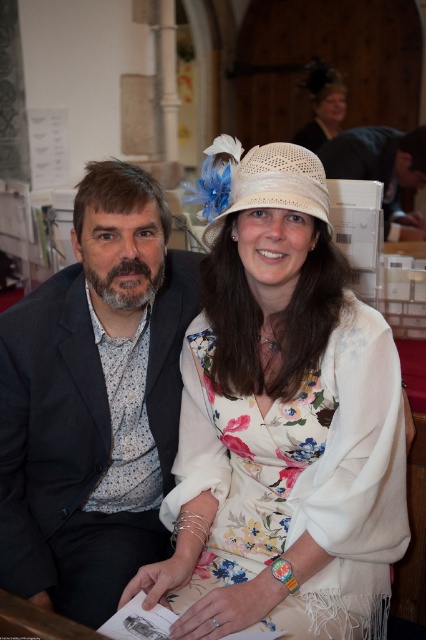
You are a photographer taking a picture of the two people in the scene. You want to ensure both the floral silk dress at center and the white straw hat at center are clearly visible in the frame. Given their sizes, which object might require more careful positioning to avoid being obscured?

The floral silk dress at center is bigger than the white straw hat at center, so the white straw hat at center might be easier to obscure and thus requires more careful positioning to ensure it stays visible in the frame.

You are standing in the center of the room and want to move towards the floral silk dress at center. Which direction should you move in?

The floral silk dress at center is located at point 0.748 in the x direction and 0.707 in the y direction. Since you are at the center, you should move towards the direction of higher x and y coordinates to reach the floral silk dress at center.

You are standing at the entrance of the venue and want to find the floral silk dress at center. According to the coordinates provided, in which direction should you look to locate it?

The floral silk dress at center is located at coordinates point (301, 477), so you should look towards the lower right direction to locate it.